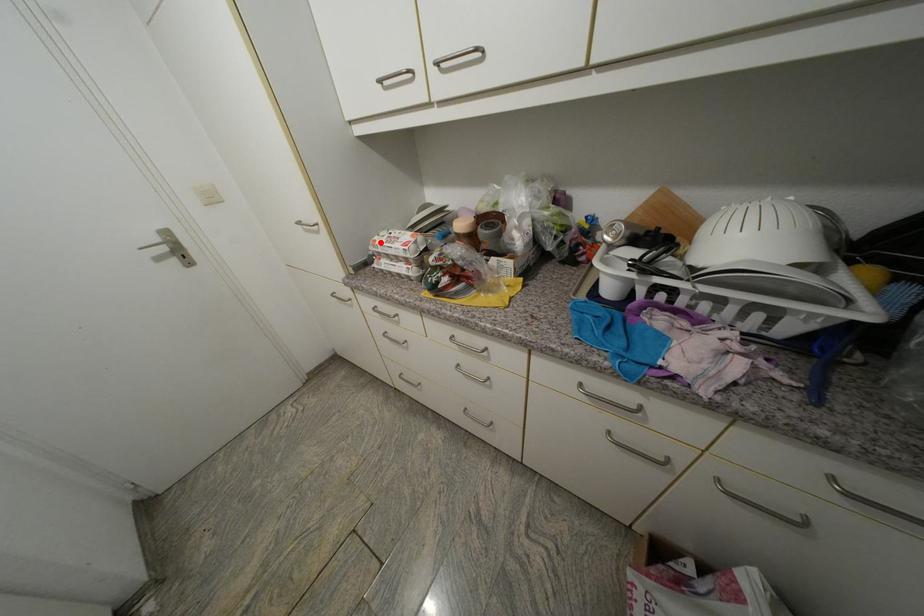
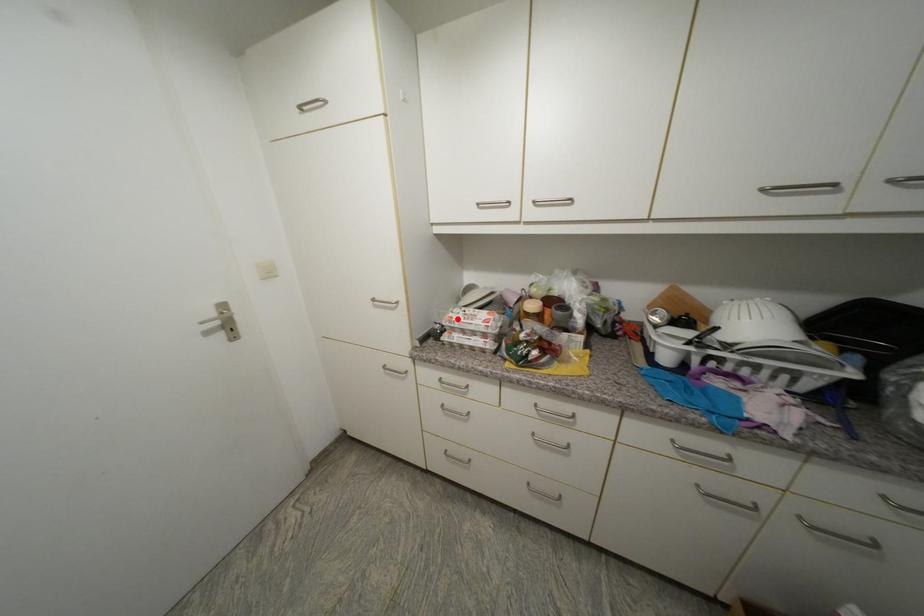
I am providing you with two images of the same scene from different viewpoints. A red point is marked on the first image and another point is marked on the second image. Does the point marked in image1 correspond to the same location as the one in image2?

Yes